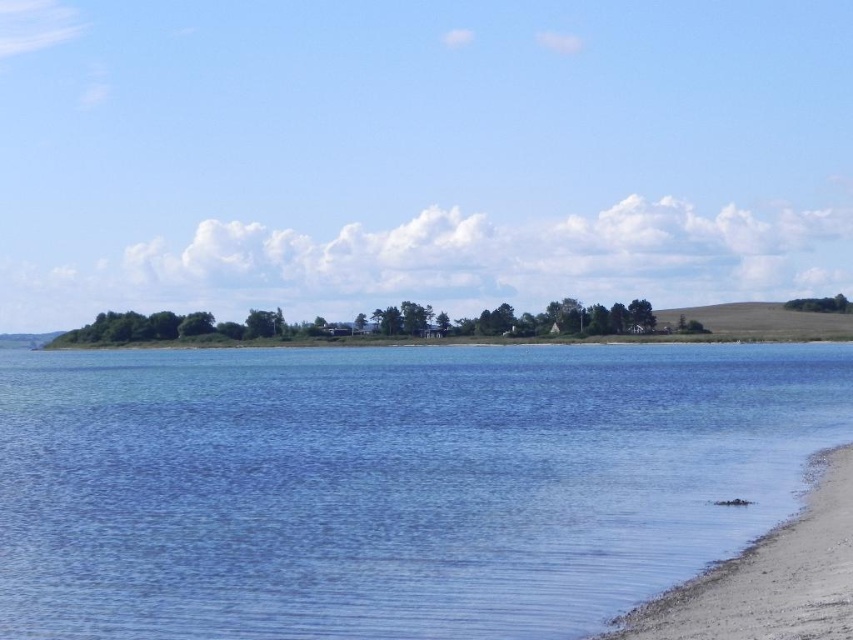
Question: Where is blue water at center located in relation to gray gravelly sand at lower right in the image?

Choices:
 (A) right
 (B) left

Answer: (B)

Question: Which point is farther to the camera?

Choices:
 (A) (65, 540)
 (B) (811, 461)

Answer: (B)

Question: Which point is farther from the camera taking this photo?

Choices:
 (A) (698, 618)
 (B) (839, 419)

Answer: (B)

Question: Is blue water at center positioned behind gray gravelly sand at lower right?

Choices:
 (A) yes
 (B) no

Answer: (A)

Question: Does blue water at center come behind gray gravelly sand at lower right?

Choices:
 (A) yes
 (B) no

Answer: (A)